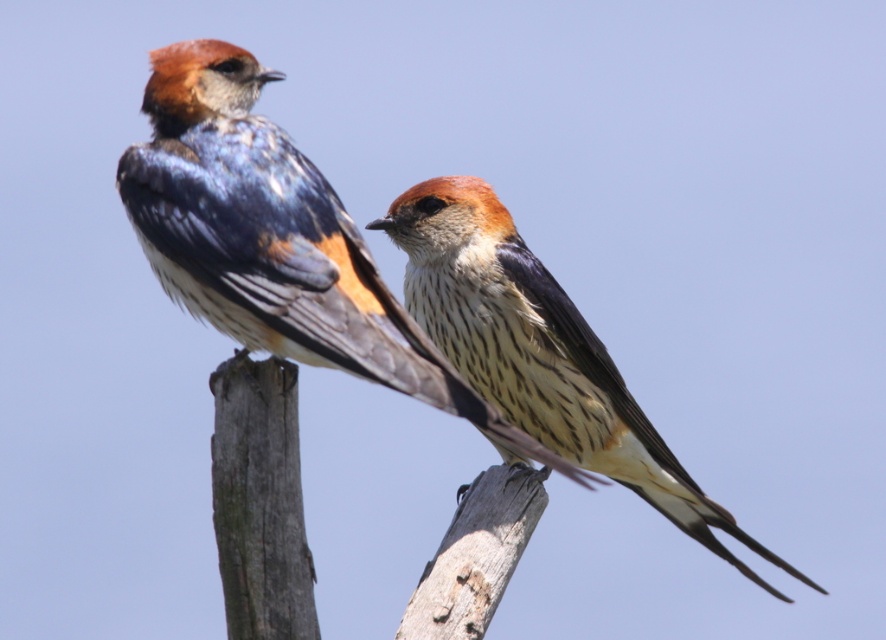
Between speckled feathered swallow at center and speckled feathered bird at center, which one appears on the right side from the viewer's perspective?

speckled feathered bird at center

Is speckled feathered swallow at center positioned before speckled feathered bird at center?

Yes, speckled feathered swallow at center is closer to the viewer.

Is point (259, 252) closer to viewer compared to point (530, 317)?

Yes, it is in front of point (530, 317).

Where is `speckled feathered swallow at center`? Image resolution: width=886 pixels, height=640 pixels. speckled feathered swallow at center is located at coordinates (274, 240).